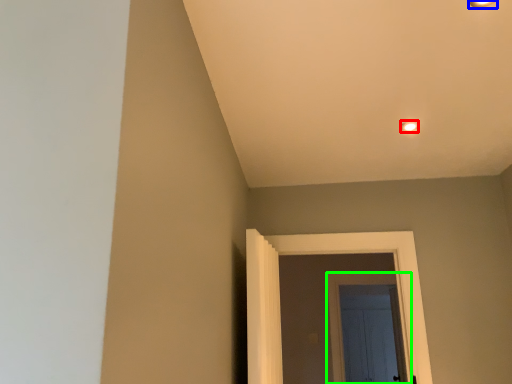
Question: Which object is the farthest from light fixture (highlighted by a red box)? Choose among these: light fixture (highlighted by a blue box) or door (highlighted by a green box).

Choices:
 (A) light fixture
 (B) door

Answer: (B)